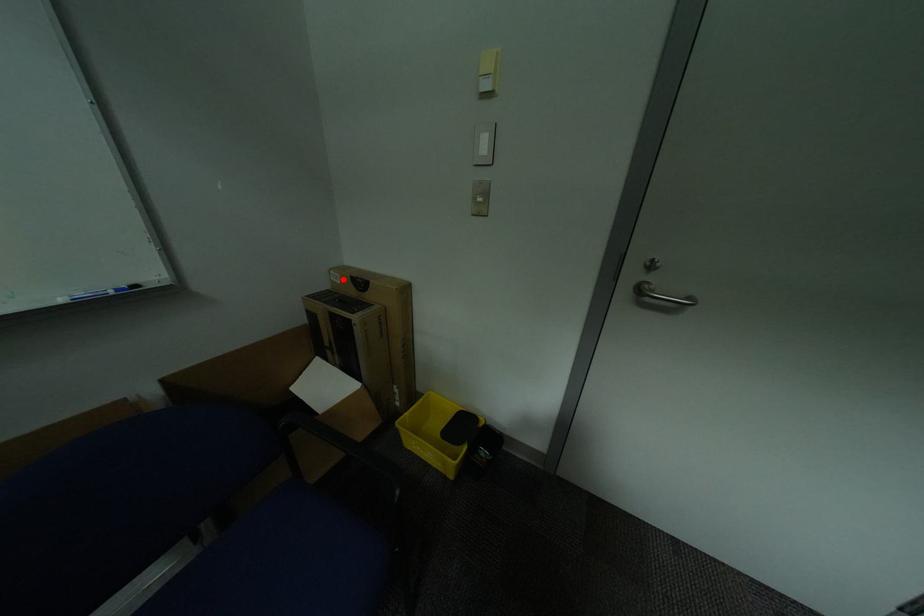
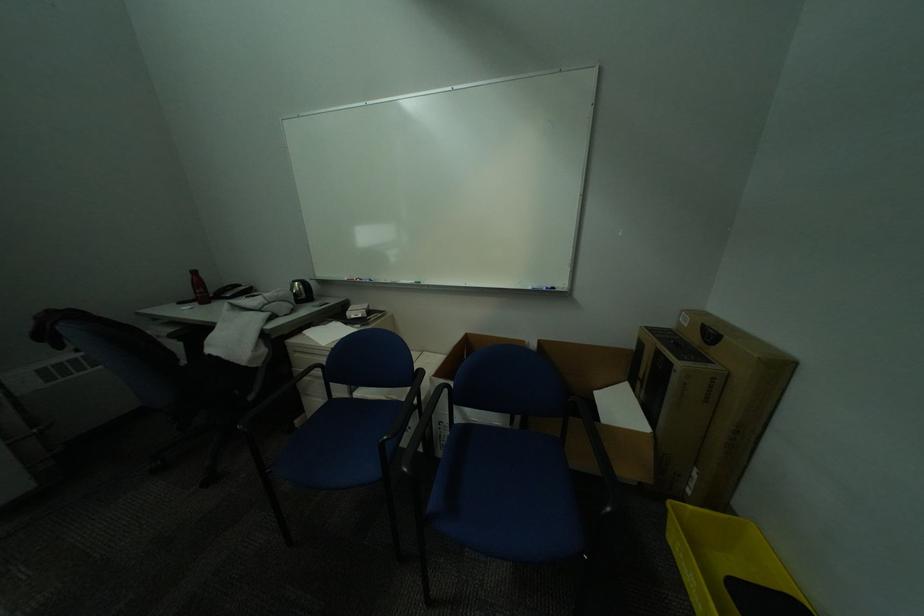
Where in the second image is the point corresponding to the highlighted location from the first image?

(691, 321)